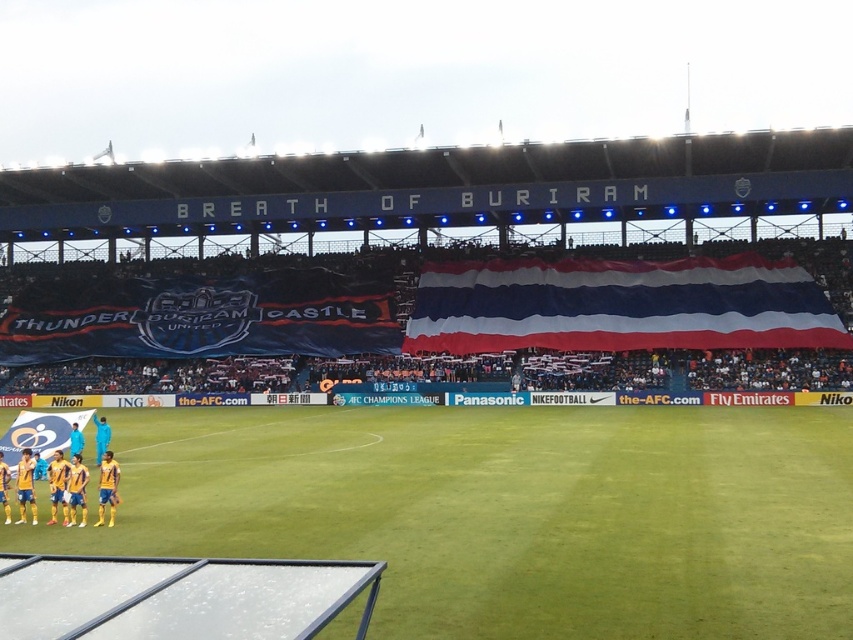
Question: Does green grass football field at lower center appear on the right side of red-white-blue fabric at upper center?

Choices:
 (A) no
 (B) yes

Answer: (A)

Question: Can you confirm if green grass football field at lower center is thinner than yellow matte jersey at lower left?

Choices:
 (A) yes
 (B) no

Answer: (B)

Question: Which of the following is the closest to the observer?

Choices:
 (A) green grass football field at lower center
 (B) yellow matte jersey at lower left

Answer: (A)

Question: Among these objects, which one is nearest to the camera?

Choices:
 (A) yellow matte jersey at lower left
 (B) red-white-blue fabric at upper center
 (C) green grass football field at lower center

Answer: (C)

Question: Among these points, which one is farthest from the camera?

Choices:
 (A) (738, 294)
 (B) (351, 435)
 (C) (67, 492)

Answer: (A)

Question: Is green grass football field at lower center below red-white-blue fabric at upper center?

Choices:
 (A) yes
 (B) no

Answer: (A)